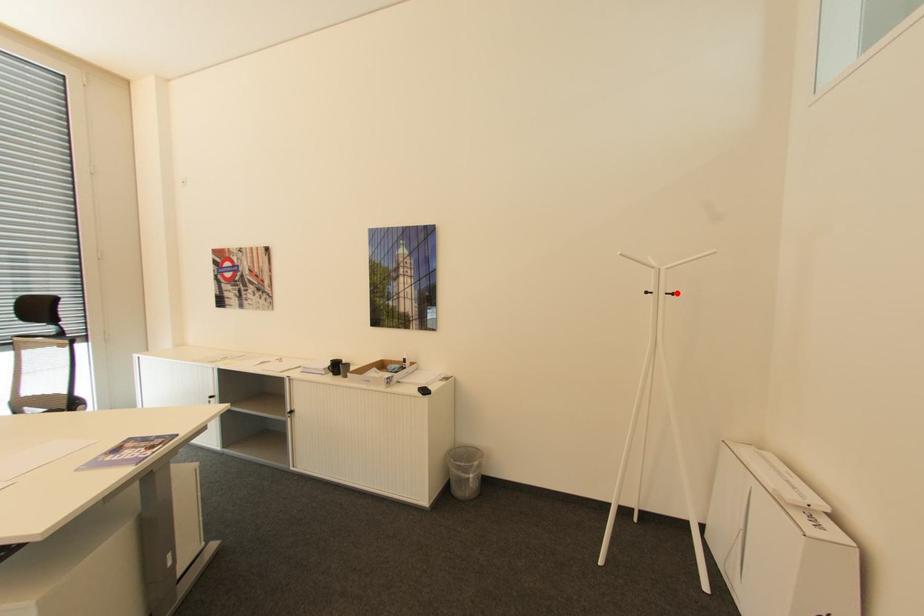
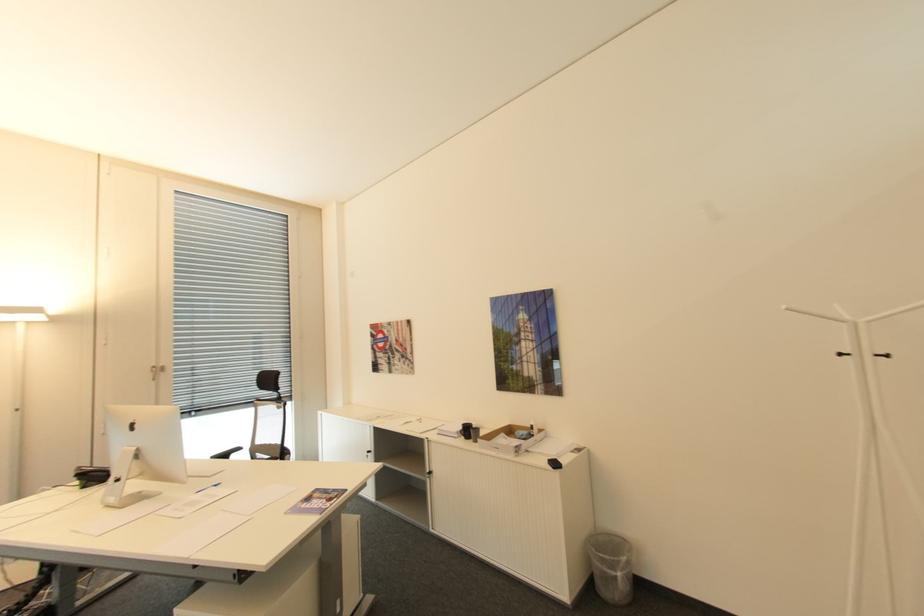
In the second image, find the point that corresponds to the highlighted location in the first image.

(894, 355)